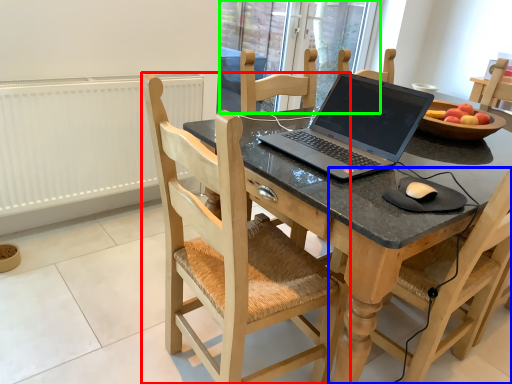
Question: Considering the real-world distances, which object is farthest from chair (highlighted by a red box)? chair (highlighted by a blue box) or glass door (highlighted by a green box)?

Choices:
 (A) chair
 (B) glass door

Answer: (B)